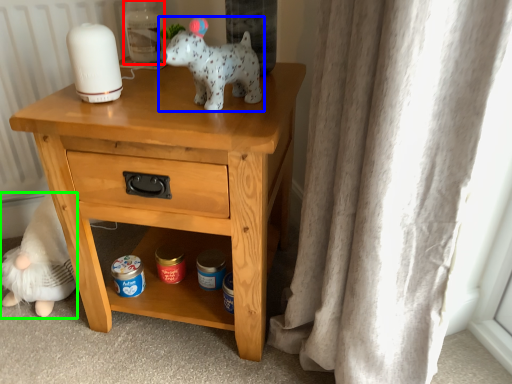
Question: Which object is the closest to the bottle (highlighted by a red box)? Choose among these: toy (highlighted by a blue box) or figurine (highlighted by a green box).

Choices:
 (A) toy
 (B) figurine

Answer: (A)